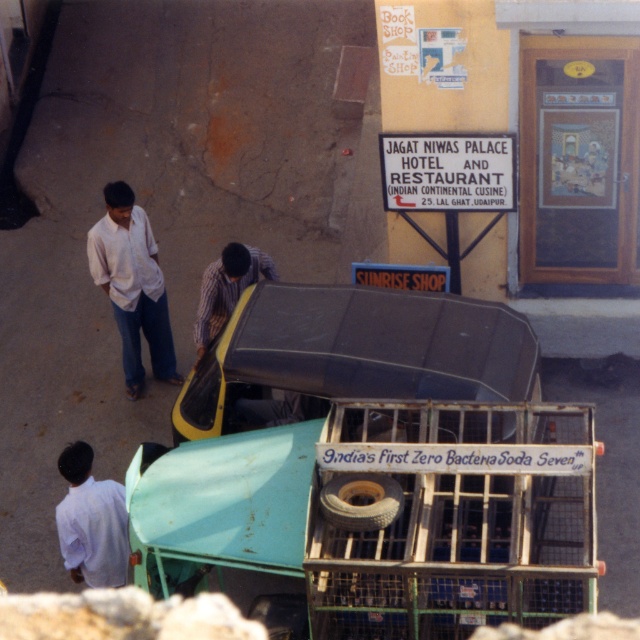
Question: Which of these objects is positioned farthest from the white cotton shirt at left?

Choices:
 (A) striped fabric shirt at center
 (B) white cotton shirt at lower left

Answer: (B)

Question: Estimate the real-world distances between objects in this image. Which object is farther from the white cotton shirt at left?

Choices:
 (A) brown rubber tire at center
 (B) yellow matte car at center

Answer: (A)

Question: Which point is closer to the camera?

Choices:
 (A) (333, 477)
 (B) (225, 397)
 (C) (218, 266)
 (D) (136, 272)

Answer: (A)

Question: Is white cotton shirt at lower left behind brown rubber tire at center?

Choices:
 (A) no
 (B) yes

Answer: (B)

Question: Is the position of yellow matte car at center more distant than that of white cotton shirt at lower left?

Choices:
 (A) no
 (B) yes

Answer: (A)

Question: Is white cotton shirt at lower left above striped fabric shirt at center?

Choices:
 (A) no
 (B) yes

Answer: (A)